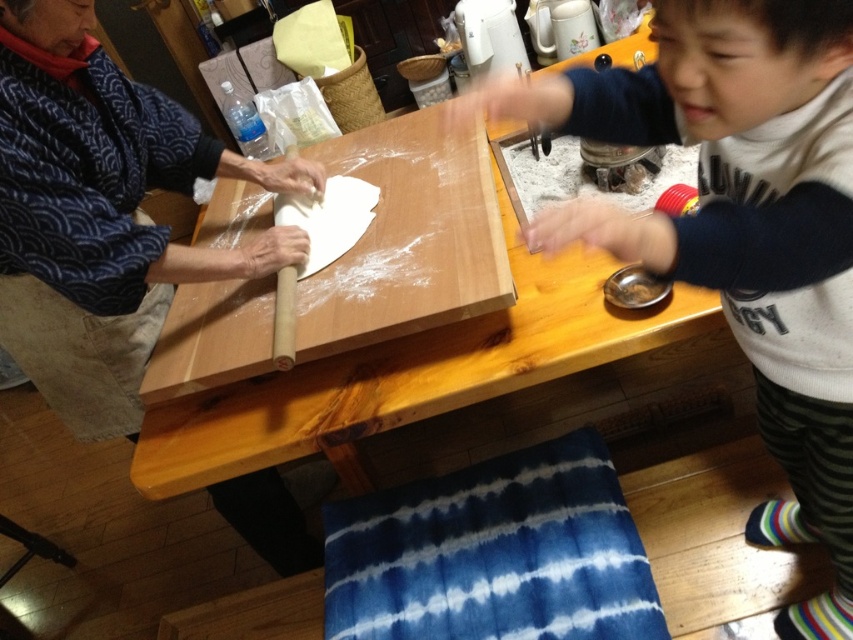
Question: Which point appears closest to the camera in this image?

Choices:
 (A) (0, 211)
 (B) (339, 221)

Answer: (A)

Question: Is white cotton sweater at right wider than matte black rolling pin at left?

Choices:
 (A) no
 (B) yes

Answer: (B)

Question: Among these points, which one is farthest from the camera?

Choices:
 (A) (331, 214)
 (B) (7, 74)
 (C) (607, 211)

Answer: (A)

Question: Which point is farther to the camera?

Choices:
 (A) white cotton sweater at right
 (B) white dough at center

Answer: (B)

Question: Is white cotton sweater at right bigger than matte black rolling pin at left?

Choices:
 (A) yes
 (B) no

Answer: (A)

Question: Does white cotton sweater at right have a greater width compared to matte black rolling pin at left?

Choices:
 (A) no
 (B) yes

Answer: (B)